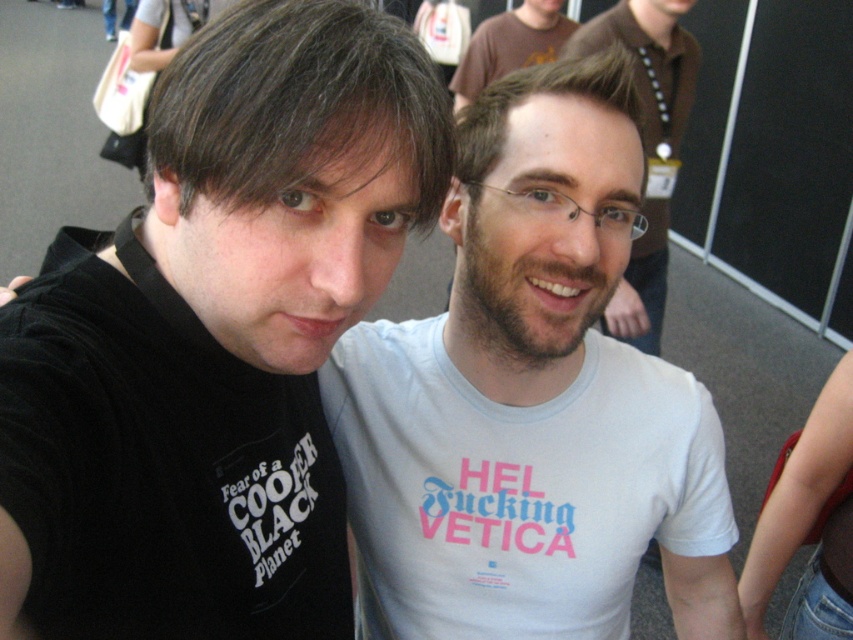
Question: Which object is the closest to the black matte t-shirt at left?

Choices:
 (A) smooth white t-shirt at center
 (B) white cotton t-shirt at center

Answer: (B)

Question: Which of these objects is positioned farthest from the matte brown t-shirt at upper center?

Choices:
 (A) black matte t-shirt at left
 (B) smooth white t-shirt at center

Answer: (A)

Question: Which of these objects is positioned closest to the matte brown t-shirt at upper center?

Choices:
 (A) black matte t-shirt at left
 (B) white cotton t-shirt at center

Answer: (B)

Question: Is white cotton t-shirt at center to the left of smooth white t-shirt at center from the viewer's perspective?

Choices:
 (A) yes
 (B) no

Answer: (A)

Question: Is white cotton t-shirt at center thinner than smooth white t-shirt at center?

Choices:
 (A) no
 (B) yes

Answer: (A)

Question: Is black matte t-shirt at left thinner than white cotton t-shirt at center?

Choices:
 (A) yes
 (B) no

Answer: (A)